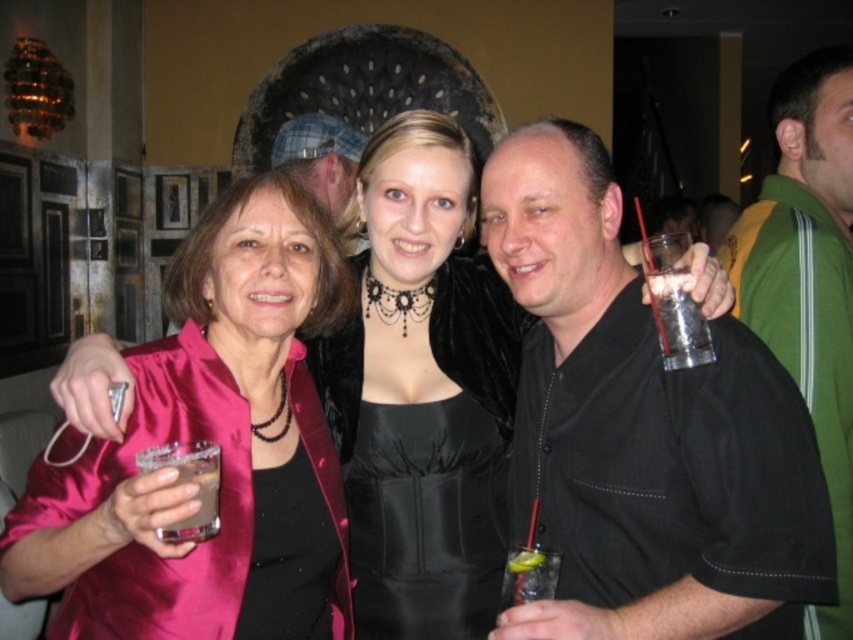
You are a photographer adjusting your camera settings to focus on the subjects in the image. Which object, the satin pink dress at center or the matte black hat at upper center, should you prioritize focusing on to ensure clarity given their positions?

The satin pink dress at center should be prioritized for focus because it is closer to the viewer than the matte black hat at upper center, ensuring clearer details when in focus.

You are a photographer at this event and need to adjust the lighting to ensure both the satin pink dress at center and the black satin dress at center are well illuminated. Given their sizes, which dress might require more space in the frame to avoid being cropped?

The satin pink dress at center has a larger size compared to the black satin dress at center, so it might require more space in the frame to avoid being cropped.

In the scene shown: You are at a party and want to hand a drink to the person wearing the green fabric jacket at right. The clear glass at right is already in their hand. Where should you place the drink?

The green fabric jacket at right is to the right of the clear glass at right, so you should place the drink to the right side of the clear glass at right.